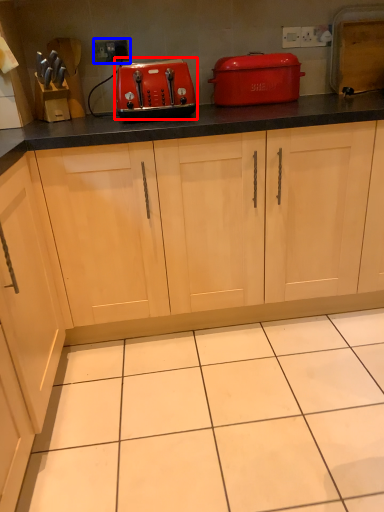
Question: Which of the following is the closest to the observer, kitchen appliance (highlighted by a red box) or electric outlet (highlighted by a blue box)?

Choices:
 (A) kitchen appliance
 (B) electric outlet

Answer: (A)